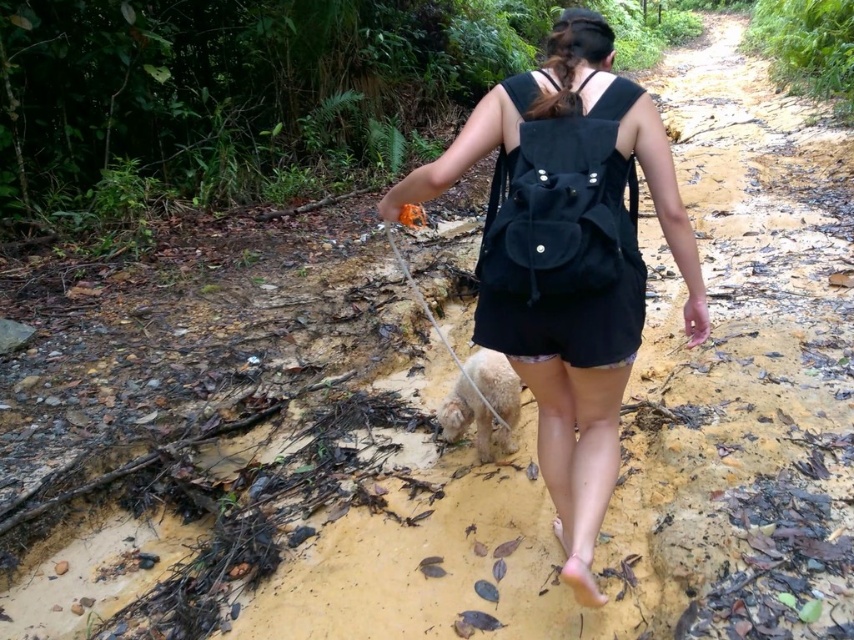
You are a drone operator trying to capture the best aerial shot of the muddy path. You have two points marked on your map, point A at coordinates point [571,561] and point B at coordinates point [506,420]. Which point should you prioritize for a closer shot to capture details of the muddy path?

Point A at coordinates point [571,561] is closer to the viewer than point B at coordinates point [506,420], so you should prioritize point A for a closer shot to capture details of the muddy path.

You are a photographer standing at the camera position. You want to capture a closeup shot of the black fabric backpack at center. Given that your camera can focus on objects within 4 feet, will you be able to take the photo without moving closer?

The black fabric backpack at center is 4.56 feet away from the camera. Since the camera can only focus within 4 feet, you will not be able to take a clear closeup shot without moving closer.

You are planning to carry a thin item that is 2 cm thick. You have the black suede backpack at center and the smooth nylon leash at lower center. Which object can fit the item more comfortably?

The black suede backpack at center can fit the thin item more comfortably since it is thinner than the smooth nylon leash at lower center, providing enough space for the item.